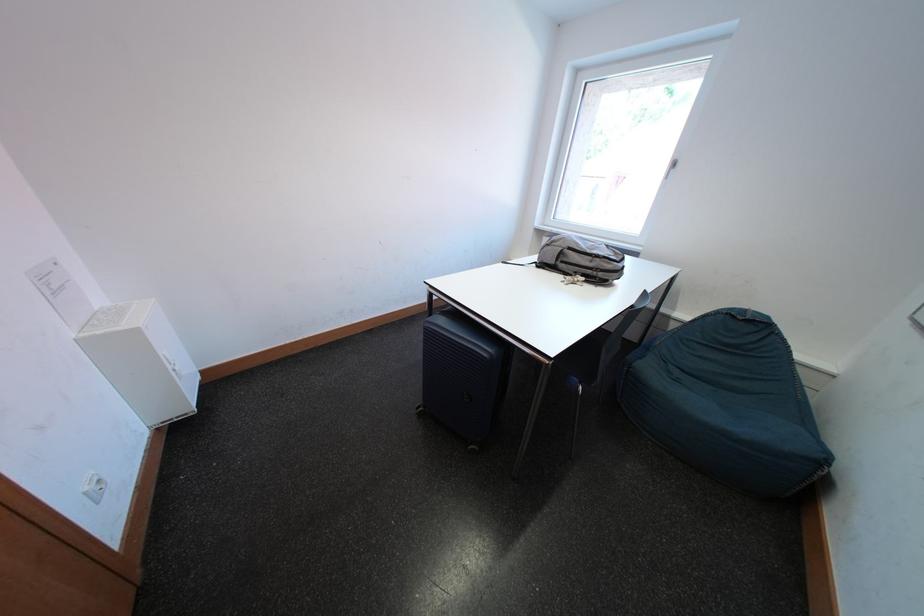
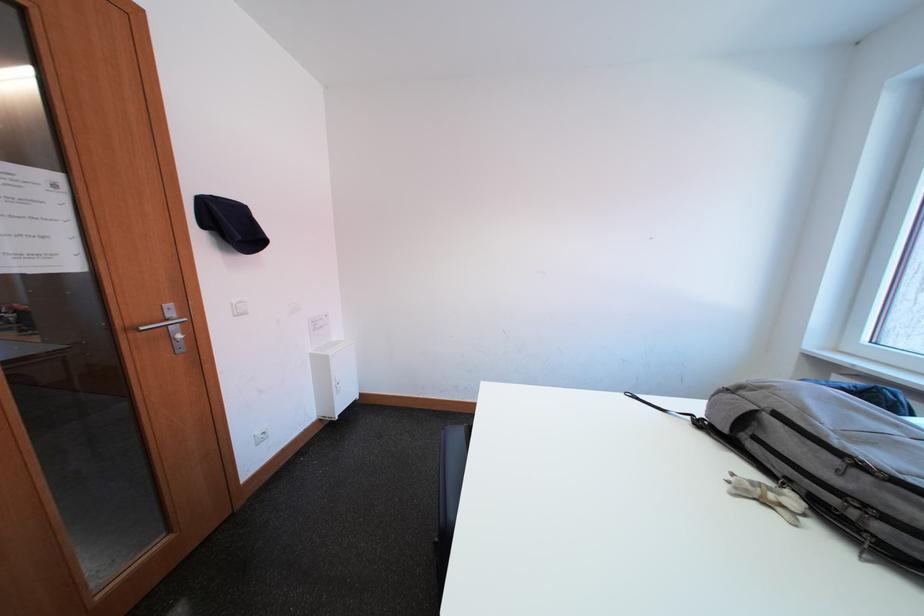
Locate, in the second image, the point that corresponds to point (553, 272) in the first image.

(719, 438)